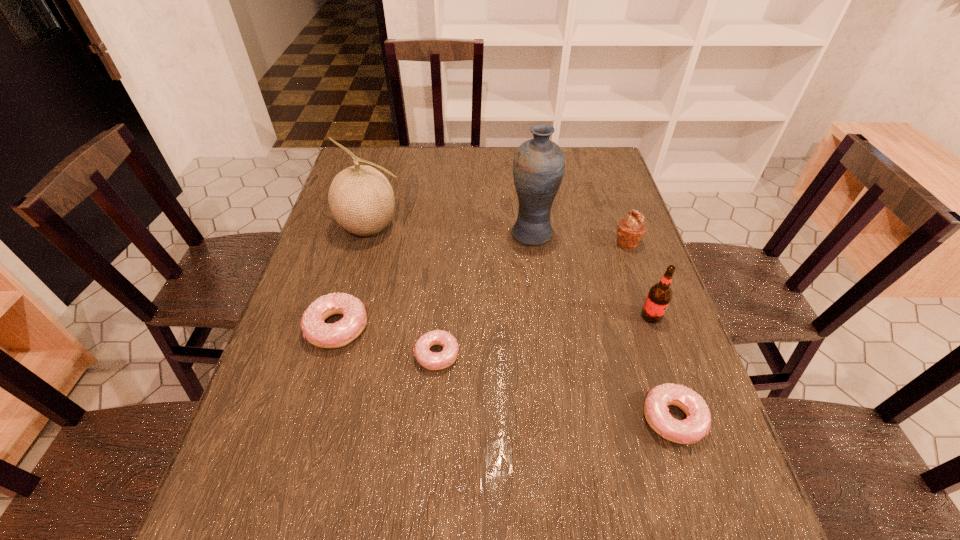
To make them evenly spaced by inserting another doughnut among them, please locate a free space for this new doughnut. Please provide its 2D coordinates. Your answer should be formatted as a tuple, i.e. [(x, y)], where the tuple contains the x and y coordinates of a point satisfying the conditions above.

[(548, 385)]